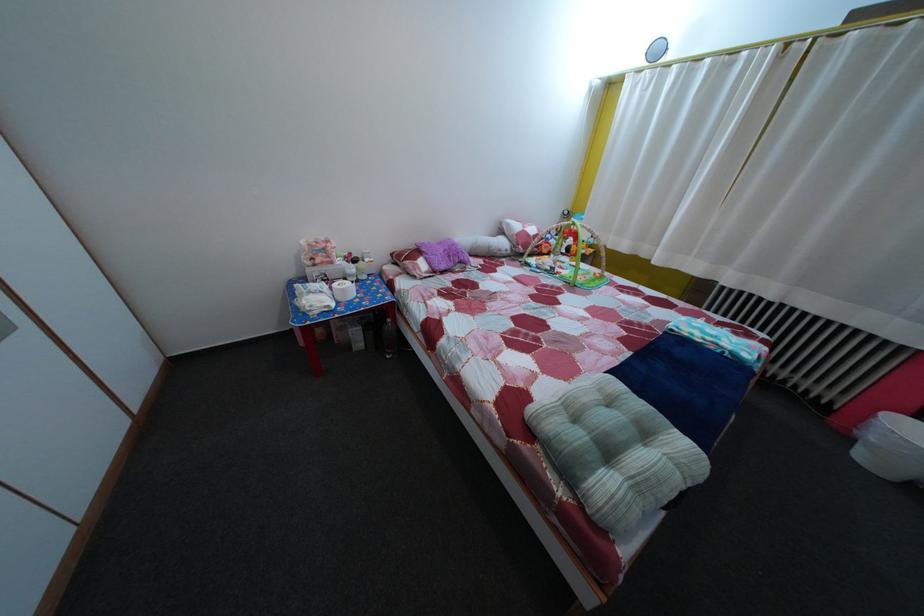
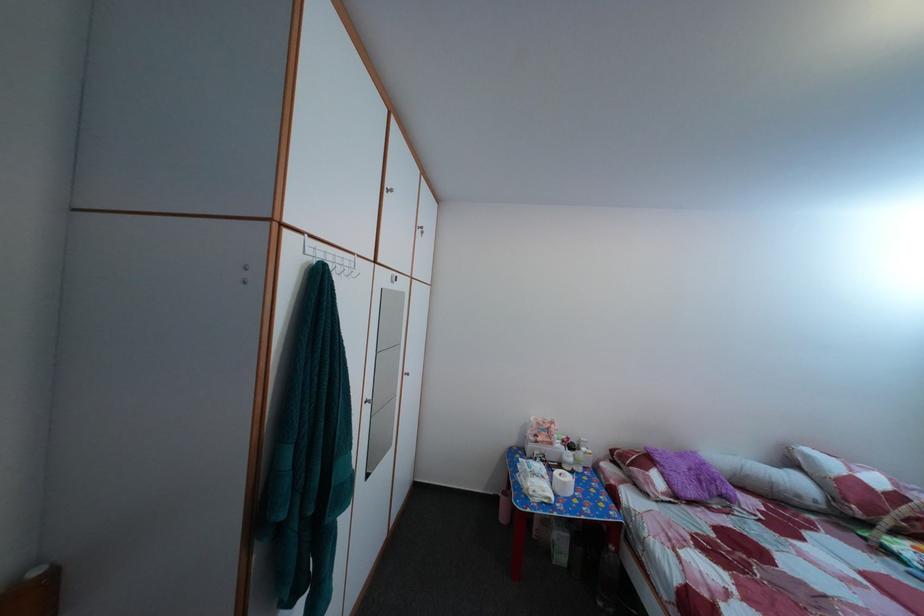
Locate, in the second image, the point that corresponds to [450,252] in the first image.

(689, 464)